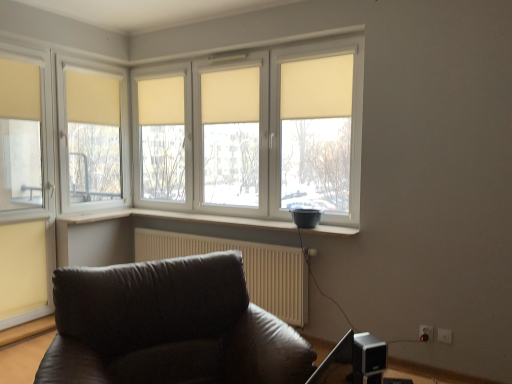
Question: Considering the relative sizes of white textured radiator at lower center and beige fabric curtain at center, which is counted as the second curtain, starting from the right, in the image provided, is white textured radiator at lower center thinner than beige fabric curtain at center, which is counted as the second curtain, starting from the right,?

Choices:
 (A) yes
 (B) no

Answer: (B)

Question: Is white textured radiator at lower center outside beige fabric curtain at center, which is counted as the second curtain, starting from the right?

Choices:
 (A) no
 (B) yes

Answer: (B)

Question: Is white textured radiator at lower center next to beige fabric curtain at center, which is counted as the second curtain, starting from the right, and touching it?

Choices:
 (A) no
 (B) yes

Answer: (A)

Question: From the image's perspective, is white textured radiator at lower center beneath beige fabric curtain at center, which is counted as the second curtain, starting from the right?

Choices:
 (A) yes
 (B) no

Answer: (A)

Question: Could you tell me if white textured radiator at lower center is turned towards beige fabric curtain at center, acting as the fourth curtain starting from the left?

Choices:
 (A) no
 (B) yes

Answer: (A)

Question: Is white plastic electric outlet at lower right, the second electric outlet when ordered from right to left, inside or outside of metallic silver speaker at lower right?

Choices:
 (A) outside
 (B) inside

Answer: (A)

Question: Is white plastic electric outlet at lower right, the second electric outlet when ordered from right to left, taller or shorter than metallic silver speaker at lower right?

Choices:
 (A) tall
 (B) short

Answer: (B)

Question: From the image's perspective, is white plastic electric outlet at lower right, the second electric outlet when ordered from right to left, located above or below metallic silver speaker at lower right?

Choices:
 (A) above
 (B) below

Answer: (B)

Question: Does point (419, 329) appear closer or farther from the camera than point (371, 339)?

Choices:
 (A) closer
 (B) farther

Answer: (B)

Question: Considering the positions of white matte window at center and matte yellow curtain at upper left, acting as the fifth curtain starting from the right, in the image, is white matte window at center taller or shorter than matte yellow curtain at upper left, acting as the fifth curtain starting from the right,?

Choices:
 (A) tall
 (B) short

Answer: (A)

Question: From the image's perspective, is white matte window at center positioned above or below matte yellow curtain at upper left, acting as the fifth curtain starting from the right?

Choices:
 (A) above
 (B) below

Answer: (B)

Question: Is point (313, 107) closer or farther from the camera than point (17, 97)?

Choices:
 (A) farther
 (B) closer

Answer: (B)

Question: Is white matte window at center to the left or to the right of matte yellow curtain at upper left, which appears as the 1th curtain when viewed from the left, in the image?

Choices:
 (A) right
 (B) left

Answer: (A)

Question: From a real-world perspective, relative to white plastic electric outlet at lower right, the second electric outlet from the left, is beige fabric curtain at center, which is the third curtain in left-to-right order, vertically above or below?

Choices:
 (A) above
 (B) below

Answer: (A)

Question: From their relative heights in the image, would you say beige fabric curtain at center, which is the third curtain in left-to-right order, is taller or shorter than white plastic electric outlet at lower right, the second electric outlet from the left?

Choices:
 (A) tall
 (B) short

Answer: (A)